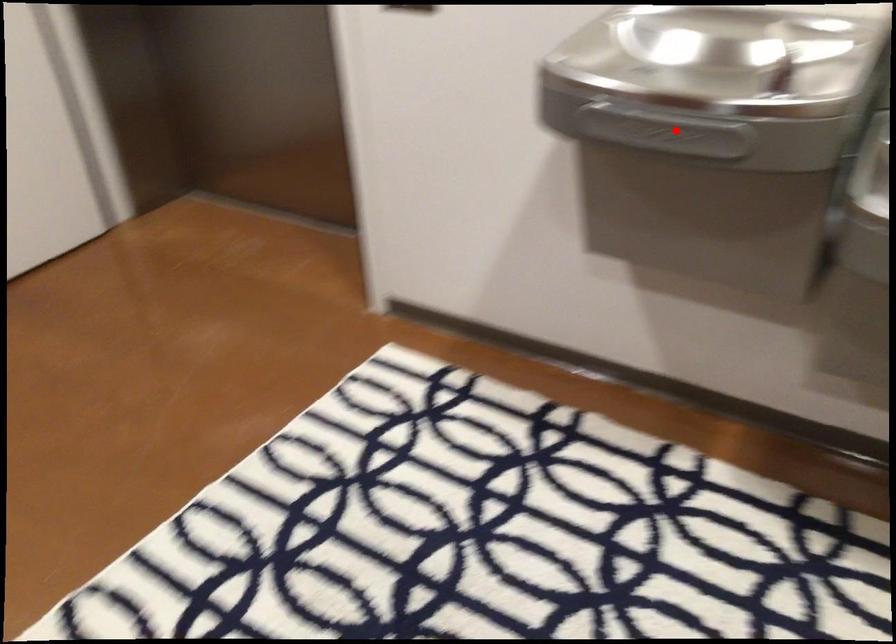
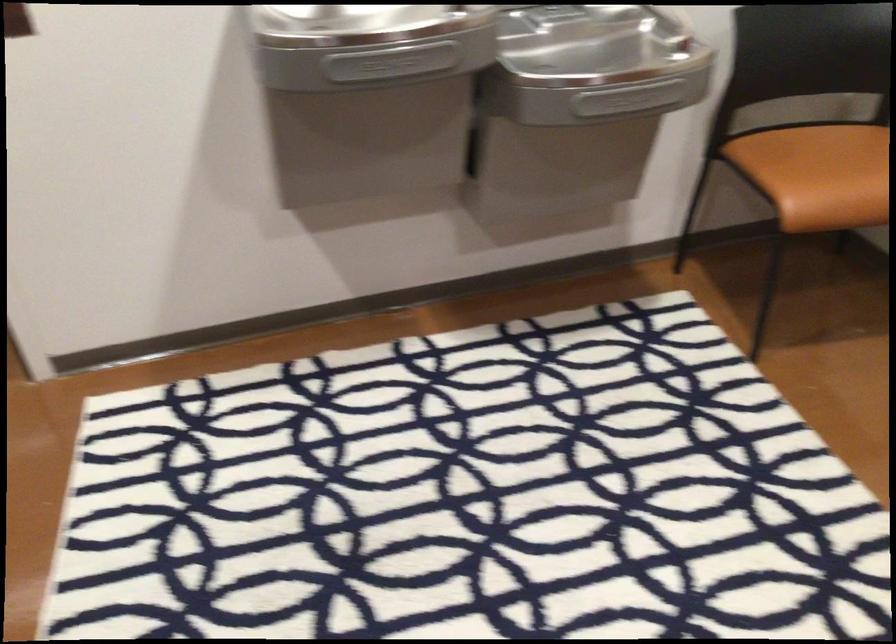
Question: A red point is marked in image1. In image2, is the corresponding 3D point closer to the camera or farther? Reply with the corresponding letter.

Choices:
 (A) The corresponding 3D point is closer.
 (B) The corresponding 3D point is farther.

Answer: (B)